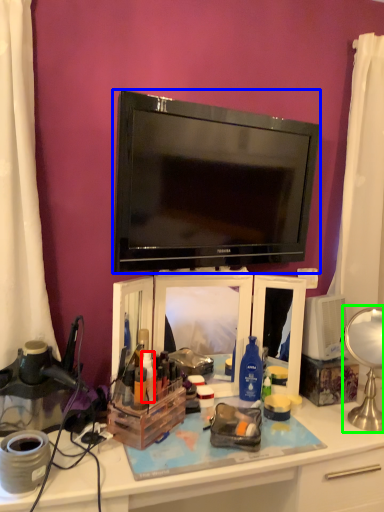
Question: Which object is positioned closest to toiletry (highlighted by a red box)? Select from television (highlighted by a blue box) and table lamp (highlighted by a green box).

Choices:
 (A) television
 (B) table lamp

Answer: (A)